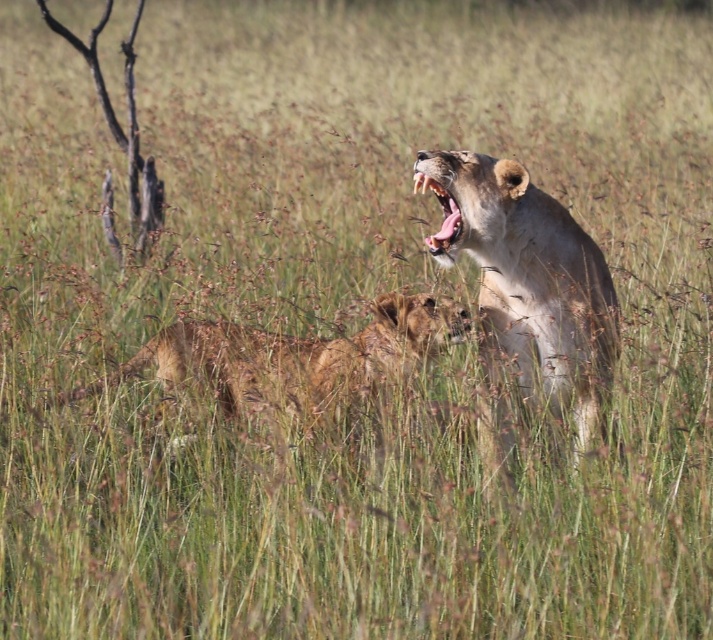
Does golden fur lion at center have a larger size compared to smooth tan lion mouth at upper right?

Correct, golden fur lion at center is larger in size than smooth tan lion mouth at upper right.

Is golden fur lion at center to the left of smooth tan lion mouth at upper right from the viewer's perspective?

Correct, you'll find golden fur lion at center to the left of smooth tan lion mouth at upper right.

Is point (140, 364) positioned in front of point (456, 221)?

That is False.

Locate an element on the screen. golden fur lion at center is located at coordinates (297, 356).

Who is lower down, light brown fur lion at upper right or golden fur lion at center?

golden fur lion at center is lower down.

Is light brown fur lion at upper right shorter than golden fur lion at center?

Incorrect, light brown fur lion at upper right's height does not fall short of golden fur lion at center's.

Image resolution: width=713 pixels, height=640 pixels. Find the location of `light brown fur lion at upper right`. light brown fur lion at upper right is located at coordinates (528, 276).

Who is more forward, (x=441, y=177) or (x=414, y=186)?

Point (x=441, y=177) is more forward.

Can you confirm if light brown fur lion at upper right is positioned to the right of smooth tan lion mouth at upper right?

Indeed, light brown fur lion at upper right is positioned on the right side of smooth tan lion mouth at upper right.

Where is `light brown fur lion at upper right`? This screenshot has height=640, width=713. light brown fur lion at upper right is located at coordinates [528, 276].